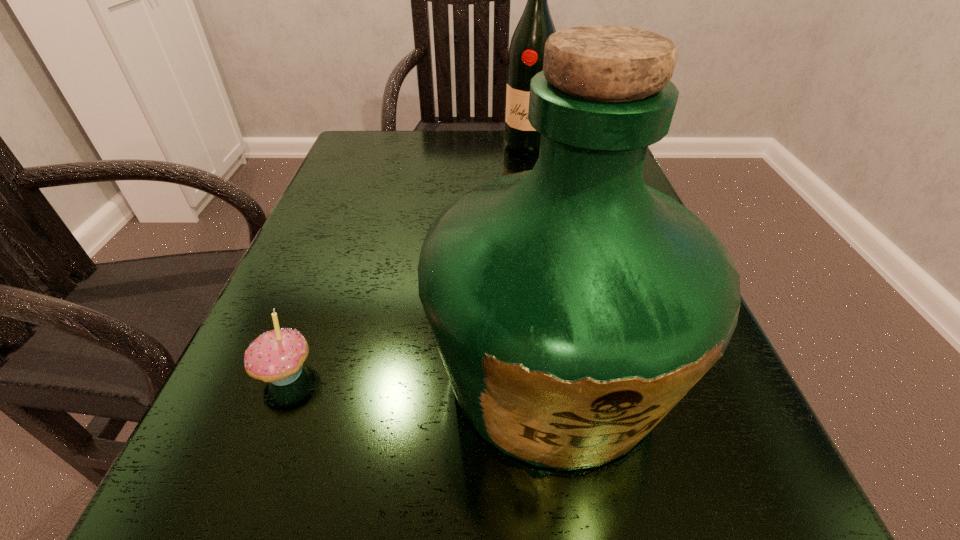
Where is `the farthest object`? the farthest object is located at coordinates [526, 52].

Find the location of a particular element. The image size is (960, 540). the nearer liquor is located at coordinates (573, 306).

Locate an element on the screen. The width and height of the screenshot is (960, 540). cupcake is located at coordinates (277, 356).

Find the location of a particular element. This screenshot has width=960, height=540. the leftmost object is located at coordinates (277, 356).

I want to click on vacant region located 0.200m on the front-facing side of the farthest object, so click(537, 200).

Find the location of a particular element. The width and height of the screenshot is (960, 540). vacant space situated 0.350m on the back of the cupcake is located at coordinates (350, 209).

The image size is (960, 540). I want to click on object situated at the far edge, so click(x=526, y=52).

The image size is (960, 540). In order to click on object at the near edge in this screenshot , I will do `click(573, 306)`.

Where is `object situated at the left edge`? object situated at the left edge is located at coordinates (277, 356).

Find the location of a particular element. object that is at the far right corner is located at coordinates (526, 52).